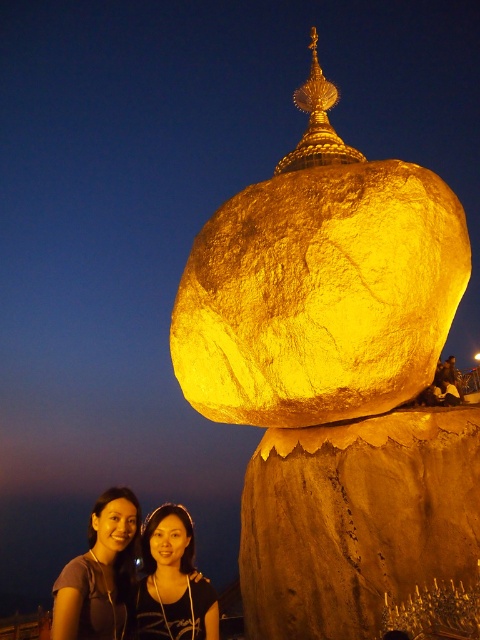
Does matte black hair at lower left appear over matte black hair at lower center?

Incorrect, matte black hair at lower left is not positioned above matte black hair at lower center.

Between matte black hair at lower left and matte black hair at lower center, which one appears on the right side from the viewer's perspective?

matte black hair at lower center

At what (x,y) coordinates should I click in order to perform the action: click on matte black hair at lower left. Please return your answer as a coordinate pair (x, y). Image resolution: width=480 pixels, height=640 pixels. Looking at the image, I should click on (99, 572).

Locate an element on the screen. matte black hair at lower left is located at coordinates (99, 572).